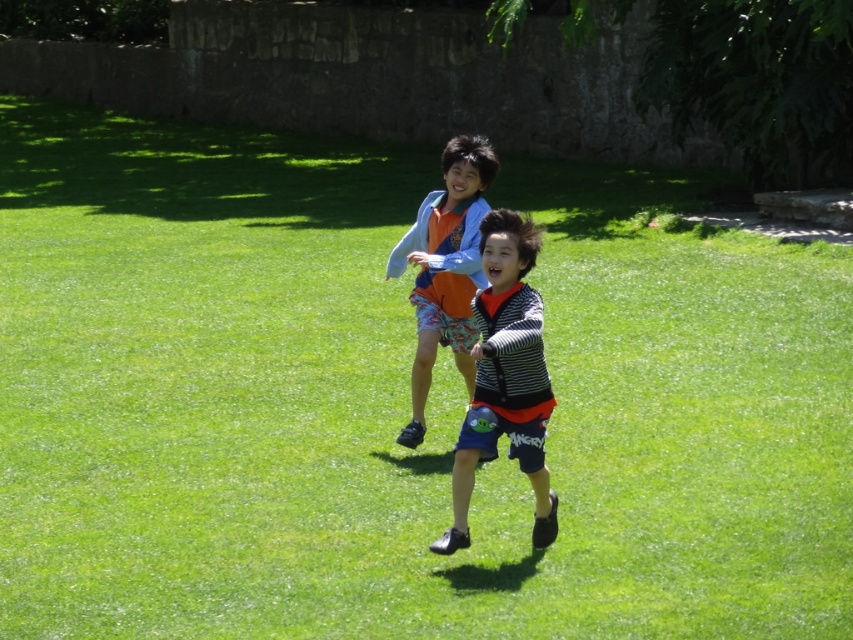
Consider the image. Between striped fabric shirt at center and orange cotton shirt at center, which one appears on the right side from the viewer's perspective?

From the viewer's perspective, striped fabric shirt at center appears more on the right side.

Does striped fabric shirt at center have a smaller size compared to orange cotton shirt at center?

Correct, striped fabric shirt at center occupies less space than orange cotton shirt at center.

Is point (491, 320) closer to viewer compared to point (426, 236)?

Yes, it is in front of point (426, 236).

The width and height of the screenshot is (853, 640). Identify the location of striped fabric shirt at center. [x=505, y=378].